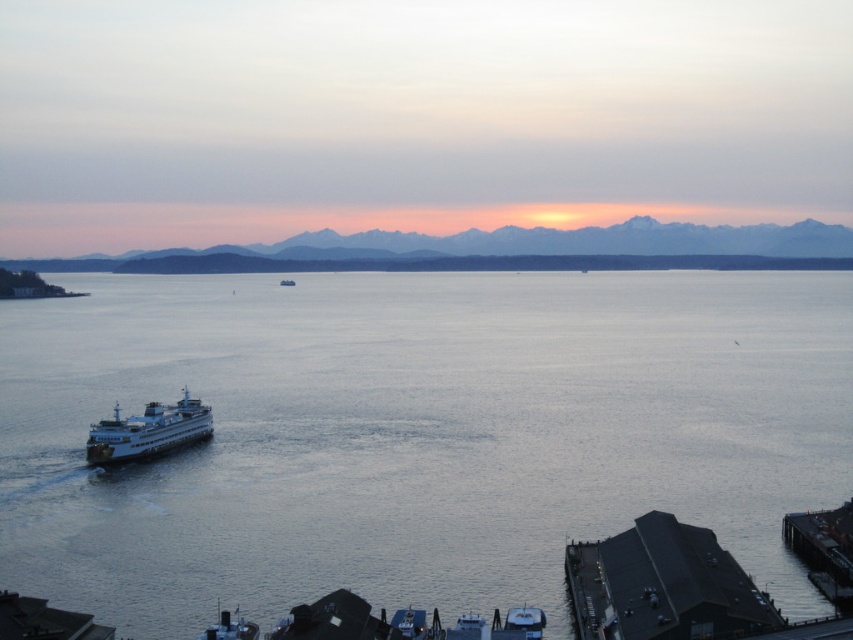
Between gray water at center and white glossy ferry at lower left, which one has more height?

With more height is gray water at center.

Is gray water at center in front of white glossy ferry at lower left?

Yes, gray water at center is closer to the viewer.

This screenshot has width=853, height=640. Find the location of `gray water at center`. gray water at center is located at coordinates (413, 435).